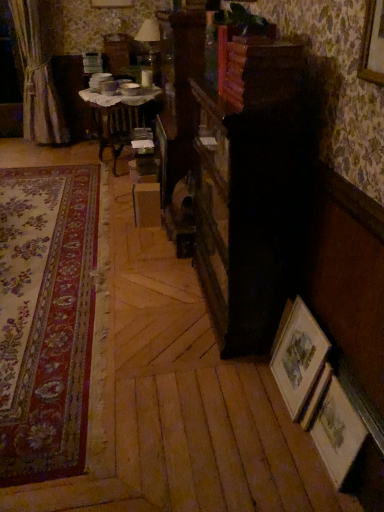
At what (x,y) coordinates should I click in order to perform the action: click on vacant space in front of wooden framed print at lower right, which appears as the 1th picture frame when viewed from the left. Please return your answer as a coordinate pair (x, y). This screenshot has height=512, width=384. Looking at the image, I should click on tap(278, 434).